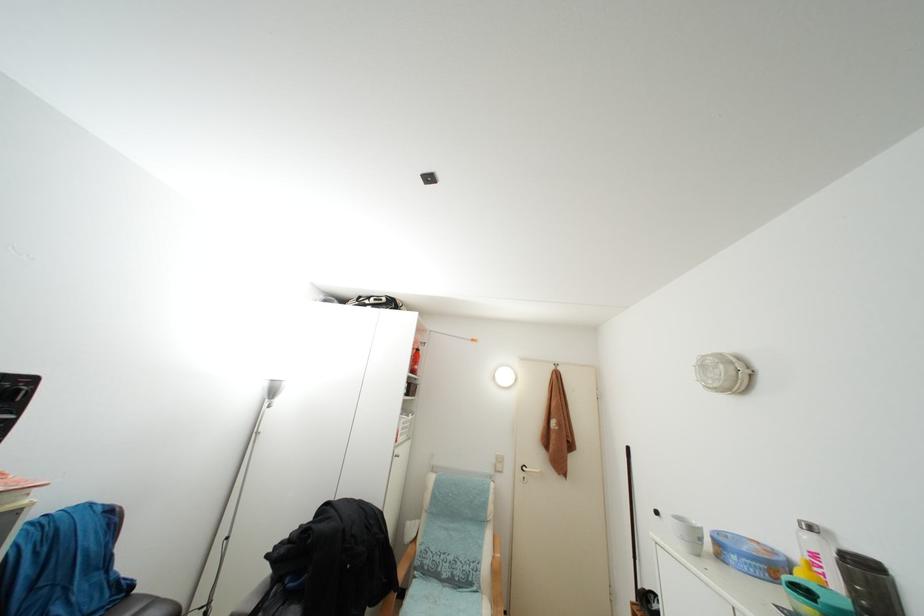
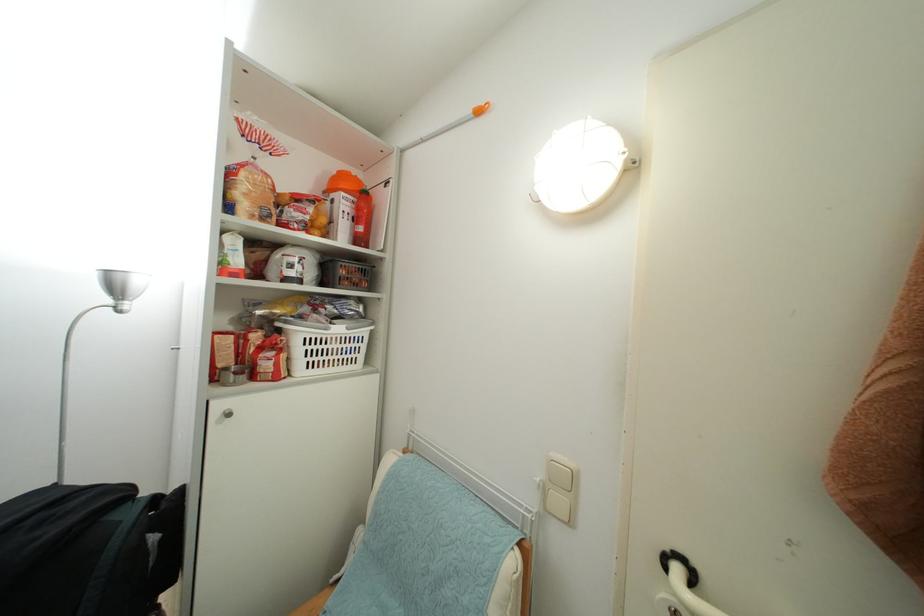
The point at (504, 472) is marked in the first image. Where is the corresponding point in the second image?

(563, 507)